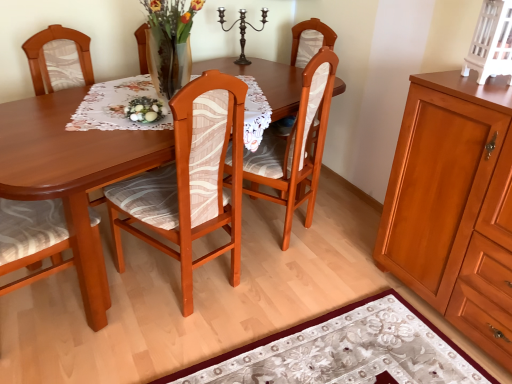
The width and height of the screenshot is (512, 384). What are the coordinates of `vacant area that lies between matte wood cabinet at right, the first cabinetry in the bottom-to-top sequence, and wooden chair at center, the second chair in the left-to-right sequence` in the screenshot? It's located at (321, 307).